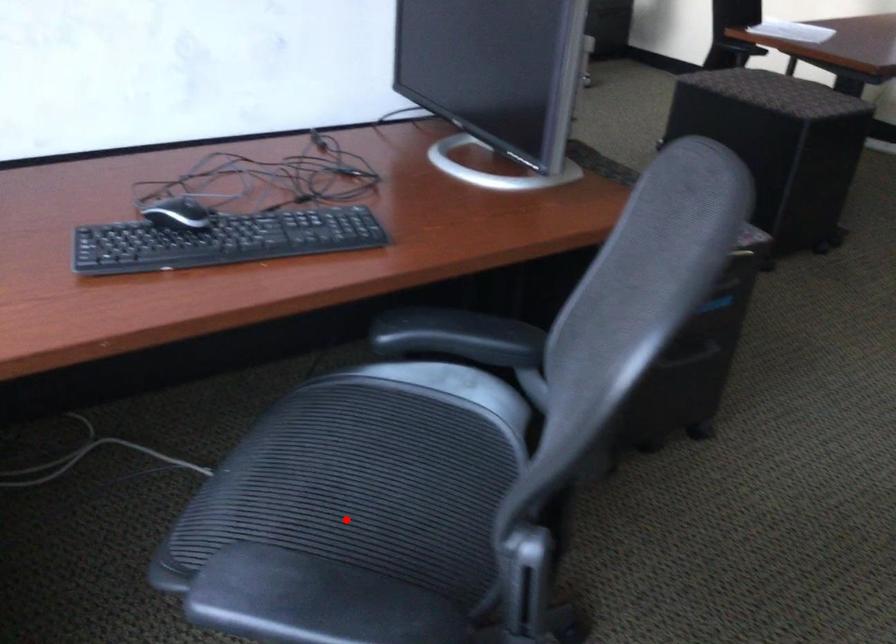
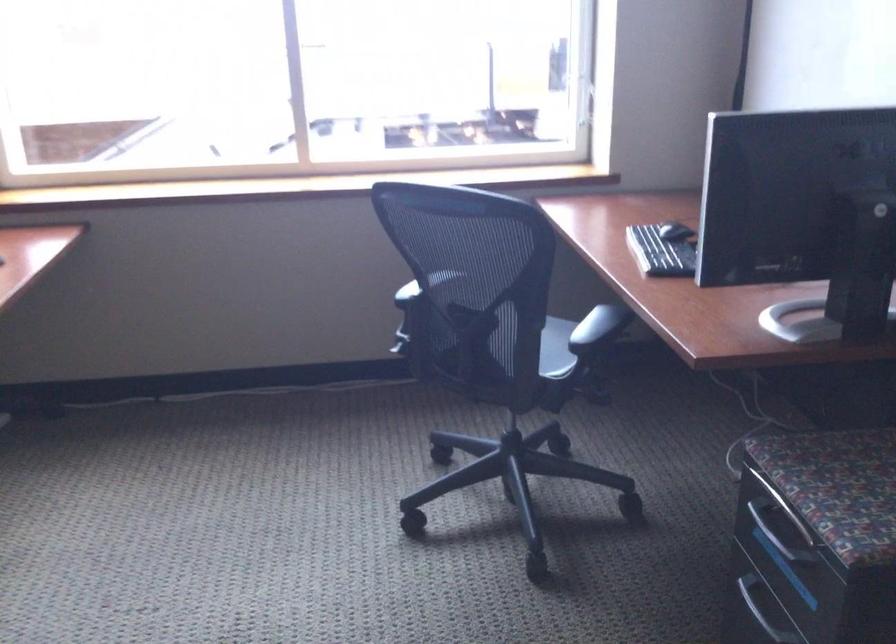
Question: I am providing you with two images of the same scene from different viewpoints. A red point is marked on the first image. Can you still see the location of the red point in image 2?

Choices:
 (A) Yes
 (B) No

Answer: (B)